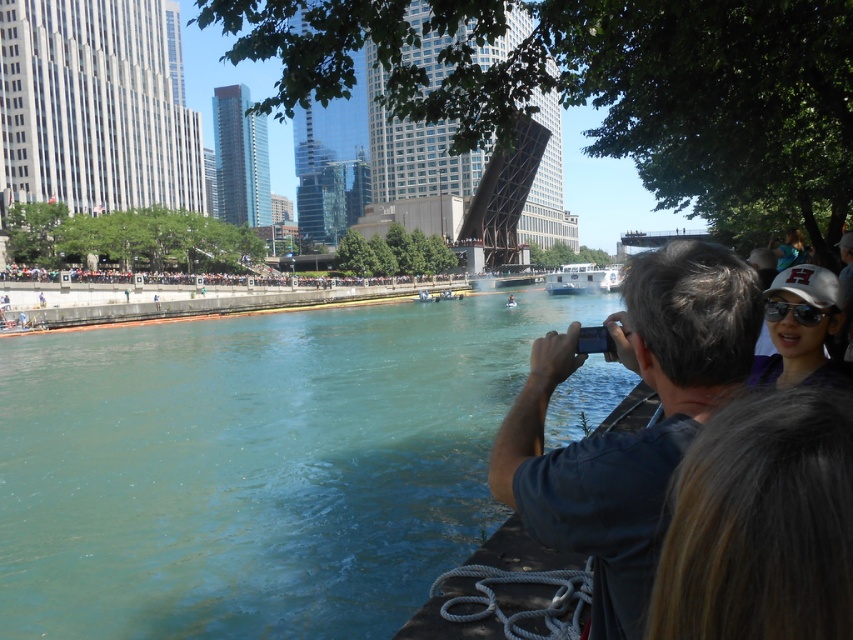
Is point (828, 372) closer to viewer compared to point (784, 252)?

Yes, point (828, 372) is closer to viewer.

Does point (788, 298) come closer to viewer compared to point (773, 246)?

Yes, point (788, 298) is in front of point (773, 246).

At what (x,y) coordinates should I click in order to perform the action: click on white matte baseball cap at upper right. Please return your answer as a coordinate pair (x, y). The height and width of the screenshot is (640, 853). Looking at the image, I should click on (799, 328).

In the scene shown: Can you confirm if dark blue shirt at center is taller than dark brown hair at upper right?

Yes, dark blue shirt at center is taller than dark brown hair at upper right.

Which is in front, point (519, 442) or point (769, 435)?

Point (769, 435)

The width and height of the screenshot is (853, 640). What are the coordinates of `dark blue shirt at center` in the screenshot? It's located at (630, 433).

Does point (26, 476) come in front of point (576, 452)?

No, (26, 476) is behind (576, 452).

Between point (212, 461) and point (625, 604), which one is positioned in front?

Point (625, 604) is more forward.

Where is `teal water at lower left`? This screenshot has height=640, width=853. teal water at lower left is located at coordinates (254, 467).